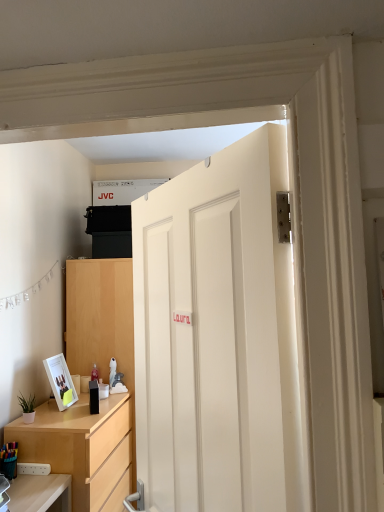
Question: Based on their positions, is multicolored plastic pen holder at lower left located to the left or right of green matte plant at lower left?

Choices:
 (A) left
 (B) right

Answer: (A)

Question: Is multicolored plastic pen holder at lower left wider or thinner than green matte plant at lower left?

Choices:
 (A) thin
 (B) wide

Answer: (B)

Question: Estimate the real-world distances between objects in this image. Which object is farther from the white matte door at center?

Choices:
 (A) light wood/texture dresser at lower left
 (B) white glossy picture frame at lower left
 (C) green matte plant at lower left
 (D) multicolored plastic pen holder at lower left

Answer: (B)

Question: Considering the real-world distances, which object is closest to the multicolored plastic pen holder at lower left?

Choices:
 (A) white glossy picture frame at lower left
 (B) green matte plant at lower left
 (C) white matte door at center
 (D) light wood/texture dresser at lower left

Answer: (B)